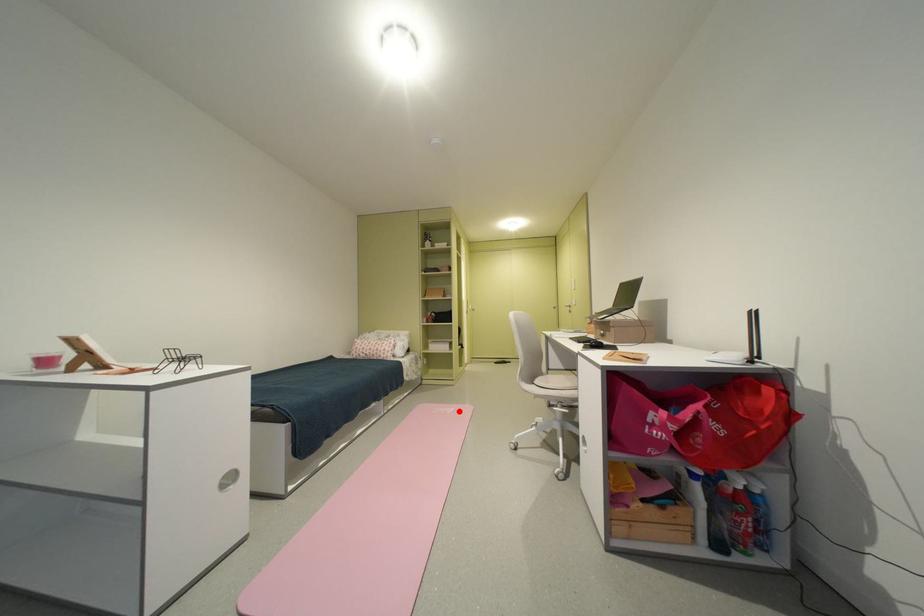
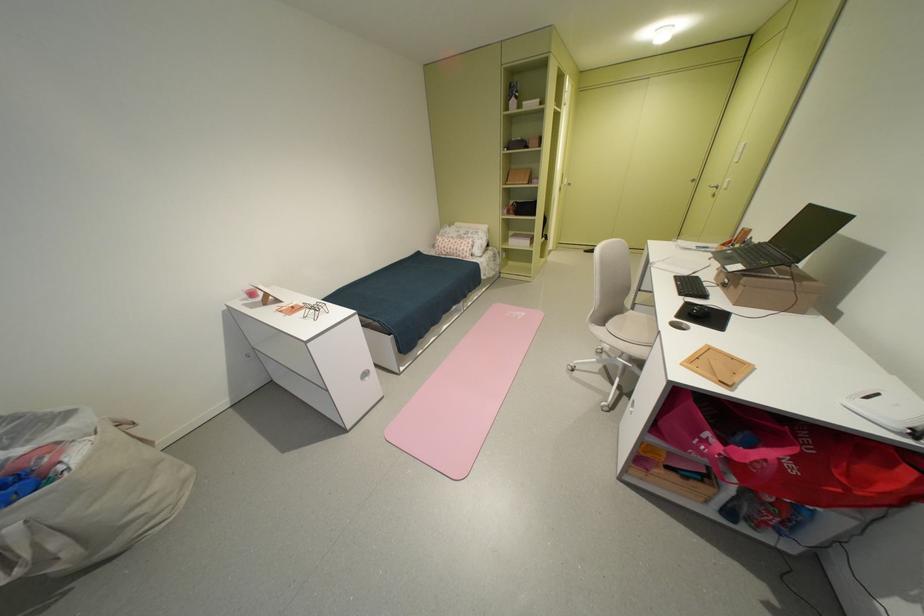
Question: I am providing you with two images of the same scene from different viewpoints. A red point is shown in image1. For the corresponding object point in image2, is it positioned nearer or farther from the camera?

Choices:
 (A) Nearer
 (B) Farther

Answer: (A)